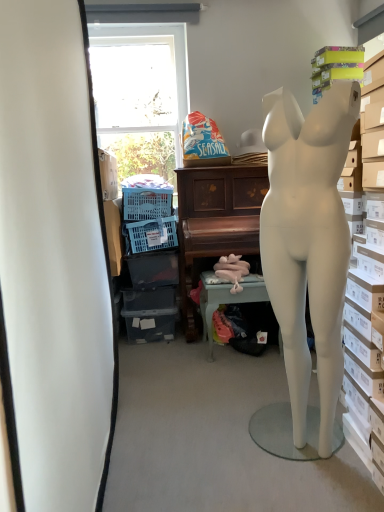
Question: From a real-world perspective, relative to white matte mannequin at right, is wooden piano at center vertically above or below?

Choices:
 (A) below
 (B) above

Answer: (A)

Question: Based on their sizes in the image, would you say wooden piano at center is bigger or smaller than white matte mannequin at right?

Choices:
 (A) small
 (B) big

Answer: (B)

Question: Considering the real-world distances, which object is closest to the white matte mannequin at right?

Choices:
 (A) blue plastic laundry basket at lower left
 (B) pink fabric-covered table at center
 (C) wooden piano at center

Answer: (B)

Question: Which object is the farthest from the blue plastic laundry basket at lower left?

Choices:
 (A) pink fabric-covered table at center
 (B) wooden piano at center
 (C) white matte mannequin at right

Answer: (C)